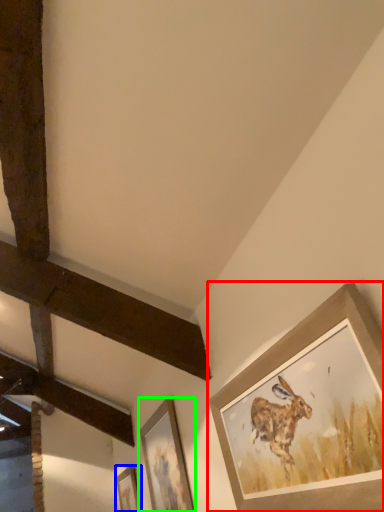
Question: Considering the real-world distances, which object is farthest from picture frame (highlighted by a red box)? picture frame (highlighted by a blue box) or picture frame (highlighted by a green box)?

Choices:
 (A) picture frame
 (B) picture frame

Answer: (A)